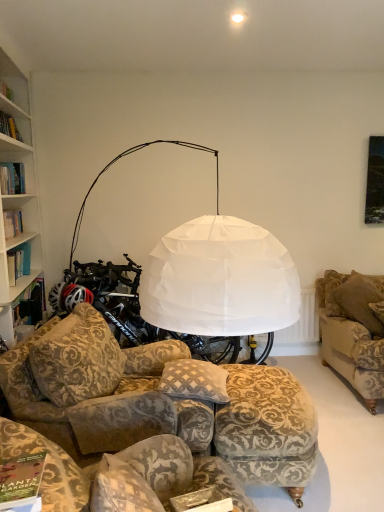
Question: Is velvet floral-patterned couch at center, the 1th studio couch in the left-to-right sequence, taller than patterned fabric pillow at center, the 2th pillow viewed from the back?

Choices:
 (A) no
 (B) yes

Answer: (B)

Question: Is velvet floral-patterned couch at center, the 2th studio couch from the right, outside of patterned fabric pillow at center, the 2th pillow viewed from the back?

Choices:
 (A) no
 (B) yes

Answer: (B)

Question: Are velvet floral-patterned couch at center, the 2th studio couch from the right, and patterned fabric pillow at center, the 2th pillow viewed from the back, beside each other?

Choices:
 (A) yes
 (B) no

Answer: (B)

Question: Considering the relative positions of velvet floral-patterned couch at center, the 1th studio couch in the left-to-right sequence, and patterned fabric pillow at center, acting as the first pillow starting from the left, in the image provided, is velvet floral-patterned couch at center, the 1th studio couch in the left-to-right sequence, behind patterned fabric pillow at center, acting as the first pillow starting from the left,?

Choices:
 (A) no
 (B) yes

Answer: (A)

Question: Can you confirm if velvet floral-patterned couch at center, the 1th studio couch in the left-to-right sequence, is bigger than patterned fabric pillow at center, acting as the first pillow starting from the left?

Choices:
 (A) yes
 (B) no

Answer: (A)

Question: Can you confirm if velvet floral-patterned couch at center, the 1th studio couch in the left-to-right sequence, is smaller than patterned fabric pillow at center, the 2th pillow viewed from the back?

Choices:
 (A) no
 (B) yes

Answer: (A)

Question: Can you confirm if velvet floral ottoman at lower center is smaller than velvet-patterned couch at lower center, marked as the 2th studio couch in a left-to-right arrangement?

Choices:
 (A) yes
 (B) no

Answer: (A)

Question: Considering the relative sizes of velvet floral ottoman at lower center and velvet-patterned couch at lower center, the 1th studio couch positioned from the right, in the image provided, is velvet floral ottoman at lower center thinner than velvet-patterned couch at lower center, the 1th studio couch positioned from the right,?

Choices:
 (A) no
 (B) yes

Answer: (B)

Question: Is the position of velvet floral ottoman at lower center less distant than that of velvet-patterned couch at lower center, the 1th studio couch positioned from the right?

Choices:
 (A) no
 (B) yes

Answer: (A)

Question: From the image's perspective, is velvet floral ottoman at lower center located above velvet-patterned couch at lower center, the 1th studio couch positioned from the right?

Choices:
 (A) no
 (B) yes

Answer: (A)

Question: Is velvet floral ottoman at lower center at the right side of velvet-patterned couch at lower center, marked as the 2th studio couch in a left-to-right arrangement?

Choices:
 (A) yes
 (B) no

Answer: (A)

Question: Is velvet floral ottoman at lower center completely or partially outside of velvet-patterned couch at lower center, the 1th studio couch positioned from the right?

Choices:
 (A) no
 (B) yes

Answer: (B)

Question: Considering the relative sizes of matte green book at lower left and velvet floral ottoman at lower center in the image provided, is matte green book at lower left smaller than velvet floral ottoman at lower center?

Choices:
 (A) yes
 (B) no

Answer: (A)